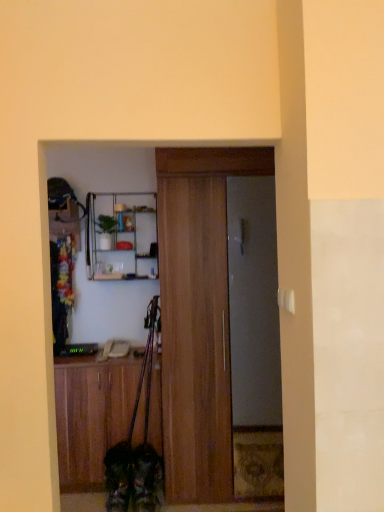
The image size is (384, 512). What do you see at coordinates (253, 302) in the screenshot?
I see `metallic gray door at center, the 1th door in the back-to-front sequence` at bounding box center [253, 302].

I want to click on metallic silver shelf at upper center, so click(121, 236).

From a real-world perspective, is metallic silver shelf at upper center positioned above or below wooden cabinet at lower left?

metallic silver shelf at upper center is situated higher than wooden cabinet at lower left in the real world.

From the image's perspective, which is below, metallic silver shelf at upper center or wooden cabinet at lower left?

wooden cabinet at lower left is shown below in the image.

Is metallic silver shelf at upper center positioned far away from wooden cabinet at lower left?

metallic silver shelf at upper center is near wooden cabinet at lower left, not far away.

Considering the sizes of objects metallic silver shelf at upper center and wooden cabinet at lower left in the image provided, who is bigger, metallic silver shelf at upper center or wooden cabinet at lower left?

With larger size is wooden cabinet at lower left.

Which of these two, metallic silver shelf at upper center or fluffy brown dog at lower center, stands shorter?

fluffy brown dog at lower center is shorter.

In the scene shown: From the image's perspective, would you say metallic silver shelf at upper center is positioned over fluffy brown dog at lower center?

Correct, metallic silver shelf at upper center appears higher than fluffy brown dog at lower center in the image.

Is metallic silver shelf at upper center further to the viewer compared to fluffy brown dog at lower center?

That is True.

Is metallic silver shelf at upper center next to wooden door at center, positioned as the first door in front-to-back order?

metallic silver shelf at upper center is not next to wooden door at center, positioned as the first door in front-to-back order, and they're not touching.

Is metallic silver shelf at upper center not within wooden door at center, which is the second door from back to front?

Absolutely, metallic silver shelf at upper center is external to wooden door at center, which is the second door from back to front.

Is metallic silver shelf at upper center facing towards wooden door at center, positioned as the first door in front-to-back order?

No, metallic silver shelf at upper center is not oriented towards wooden door at center, positioned as the first door in front-to-back order.

How much distance is there between metallic silver shelf at upper center and metallic gray door at center, the 1th door in the back-to-front sequence?

A distance of 35.91 inches exists between metallic silver shelf at upper center and metallic gray door at center, the 1th door in the back-to-front sequence.

Can you tell me how much metallic silver shelf at upper center and metallic gray door at center, the 1th door in the back-to-front sequence, differ in facing direction?

There is a 2.18-degree angle between the facing directions of metallic silver shelf at upper center and metallic gray door at center, the 1th door in the back-to-front sequence.

Does metallic silver shelf at upper center appear on the right side of metallic gray door at center, the 1th door in the back-to-front sequence?

In fact, metallic silver shelf at upper center is to the left of metallic gray door at center, the 1th door in the back-to-front sequence.

Could metallic gray door at center, the 2th door when ordered from front to back, be considered to be inside metallic silver shelf at upper center?

No.

Can you tell me how much fluffy brown dog at lower center and metallic silver shelf at upper center differ in facing direction?

The angle between the facing direction of fluffy brown dog at lower center and the facing direction of metallic silver shelf at upper center is 2.07 degrees.

Between fluffy brown dog at lower center and metallic silver shelf at upper center, which one appears on the left side from the viewer's perspective?

From the viewer's perspective, metallic silver shelf at upper center appears more on the left side.

Measure the distance from fluffy brown dog at lower center to metallic silver shelf at upper center.

fluffy brown dog at lower center is 4.33 feet away from metallic silver shelf at upper center.

Is fluffy brown dog at lower center bigger than metallic silver shelf at upper center?

No, fluffy brown dog at lower center is not bigger than metallic silver shelf at upper center.

Which is in front, metallic gray door at center, the 1th door in the back-to-front sequence, or metallic silver shelf at upper center?

metallic gray door at center, the 1th door in the back-to-front sequence, is in front.

Looking at their sizes, would you say metallic gray door at center, the 1th door in the back-to-front sequence, is wider or thinner than metallic silver shelf at upper center?

metallic gray door at center, the 1th door in the back-to-front sequence, is thinner than metallic silver shelf at upper center.

Between metallic gray door at center, the 1th door in the back-to-front sequence, and metallic silver shelf at upper center, which one has less height?

With less height is metallic silver shelf at upper center.

From a real-world perspective, does wooden cabinet at lower left stand above fluffy brown dog at lower center?

Correct, in the physical world, wooden cabinet at lower left is higher than fluffy brown dog at lower center.

Would you say wooden cabinet at lower left is outside fluffy brown dog at lower center?

Yes, wooden cabinet at lower left is outside of fluffy brown dog at lower center.

Consider the image. Can you confirm if wooden cabinet at lower left is smaller than fluffy brown dog at lower center?

No, wooden cabinet at lower left is not smaller than fluffy brown dog at lower center.

Which object is more forward, wooden cabinet at lower left or fluffy brown dog at lower center?

fluffy brown dog at lower center is more forward.

The width and height of the screenshot is (384, 512). In order to click on shelf that appears above the wooden cabinet at lower left (from the image's perspective) in this screenshot , I will do `click(121, 236)`.

Where is `dog below the metallic silver shelf at upper center (from a real-world perspective)`? This screenshot has width=384, height=512. dog below the metallic silver shelf at upper center (from a real-world perspective) is located at coordinates [118, 476].

Based on their spatial positions, is metallic silver shelf at upper center or fluffy brown dog at lower center further from wooden cabinet at lower left?

metallic silver shelf at upper center is positioned further to the anchor wooden cabinet at lower left.

Considering their positions, is metallic gray door at center, the 2th door when ordered from front to back, positioned further to wooden cabinet at lower left than metallic silver shelf at upper center?

Among the two, metallic gray door at center, the 2th door when ordered from front to back, is located further to wooden cabinet at lower left.

Estimate the real-world distances between objects in this image. Which object is further from metallic silver shelf at upper center, wooden cabinet at lower left or fluffy brown dog at lower center?

fluffy brown dog at lower center lies further to metallic silver shelf at upper center than the other object.

Looking at the image, which one is located further to fluffy brown dog at lower center, wooden door at center, which is the second door from back to front, or metallic gray door at center, the 1th door in the back-to-front sequence?

metallic gray door at center, the 1th door in the back-to-front sequence.

Consider the image. Considering their positions, is metallic silver shelf at upper center positioned closer to metallic gray door at center, the 1th door in the back-to-front sequence, than wooden door at center, positioned as the first door in front-to-back order?

wooden door at center, positioned as the first door in front-to-back order, lies closer to metallic gray door at center, the 1th door in the back-to-front sequence, than the other object.

Looking at the image, which one is located closer to wooden cabinet at lower left, wooden door at center, which is the second door from back to front, or metallic silver shelf at upper center?

Based on the image, wooden door at center, which is the second door from back to front, appears to be nearer to wooden cabinet at lower left.

From the image, which object appears to be nearer to wooden cabinet at lower left, fluffy brown dog at lower center or metallic gray door at center, the 2th door when ordered from front to back?

fluffy brown dog at lower center is positioned closer to the anchor wooden cabinet at lower left.

When comparing their distances from wooden cabinet at lower left, does wooden door at center, which is the second door from back to front, or metallic gray door at center, the 2th door when ordered from front to back, seem further?

metallic gray door at center, the 2th door when ordered from front to back, is positioned further to the anchor wooden cabinet at lower left.

I want to click on dog between wooden cabinet at lower left and metallic gray door at center, the 2th door when ordered from front to back, in the horizontal direction, so click(x=118, y=476).

The height and width of the screenshot is (512, 384). Identify the location of door that lies between wooden door at center, positioned as the first door in front-to-back order, and fluffy brown dog at lower center from top to bottom. (253, 302).

I want to click on door between wooden cabinet at lower left and metallic gray door at center, the 2th door when ordered from front to back, in the horizontal direction, so click(198, 315).

This screenshot has height=512, width=384. Find the location of `cabinetry between wooden door at center, positioned as the first door in front-to-back order, and fluffy brown dog at lower center vertically`. cabinetry between wooden door at center, positioned as the first door in front-to-back order, and fluffy brown dog at lower center vertically is located at coordinates (91, 416).